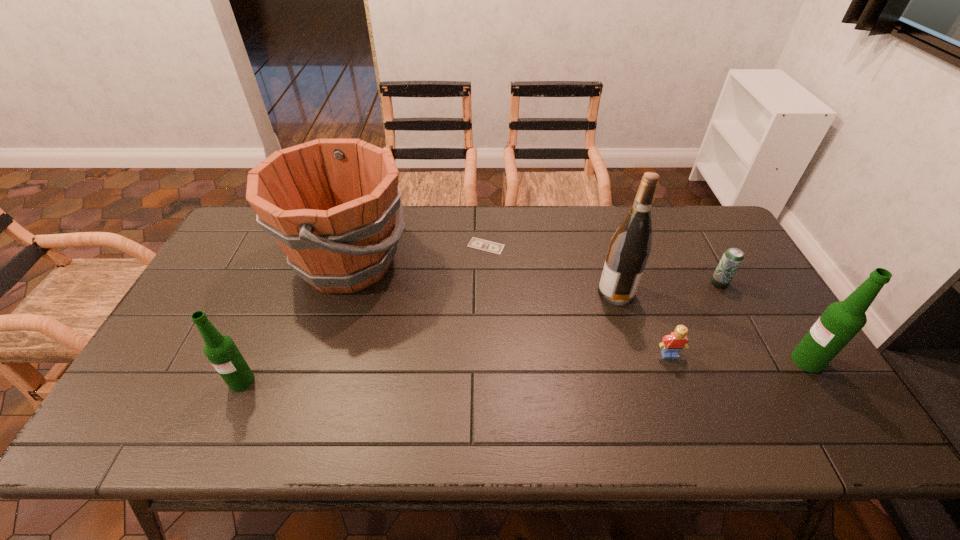
At what (x,y) coordinates should I click in order to perform the action: click on object identified as the sixth closest to the fourth object from left to right. Please return your answer as a coordinate pair (x, y). Image resolution: width=960 pixels, height=540 pixels. Looking at the image, I should click on (221, 351).

Where is `free region that satisfies the following two spatial constraints: 1. on the handle side of the bucket; 2. on the right side of the fourth object from right to left`? free region that satisfies the following two spatial constraints: 1. on the handle side of the bucket; 2. on the right side of the fourth object from right to left is located at coordinates (339, 292).

You are a GUI agent. You are given a task and a screenshot of the screen. Output one action in this format:
    pyautogui.click(x=<x>, y=<y>)
    Task: Click on the free space that satisfies the following two spatial constraints: 1. on the front side of the fifth object from right to left; 2. on the handle side of the bucket
    
    Given the screenshot: What is the action you would take?
    pyautogui.click(x=487, y=262)

The width and height of the screenshot is (960, 540). Find the location of `blank area in the image that satisfies the following two spatial constraints: 1. on the front side of the shortest object; 2. on the right side of the fourth object from left to right`. blank area in the image that satisfies the following two spatial constraints: 1. on the front side of the shortest object; 2. on the right side of the fourth object from left to right is located at coordinates (487, 292).

At what (x,y) coordinates should I click in order to perform the action: click on vacant position in the image that satisfies the following two spatial constraints: 1. on the label of the rightmost object; 2. on the label of the shorter beer bottle. Please return your answer as a coordinate pair (x, y). The height and width of the screenshot is (540, 960). Looking at the image, I should click on (820, 381).

Where is `vacant space that satisfies the following two spatial constraints: 1. on the label of the taller beer bottle; 2. on the label of the left beer bottle`? Image resolution: width=960 pixels, height=540 pixels. vacant space that satisfies the following two spatial constraints: 1. on the label of the taller beer bottle; 2. on the label of the left beer bottle is located at coordinates (820, 381).